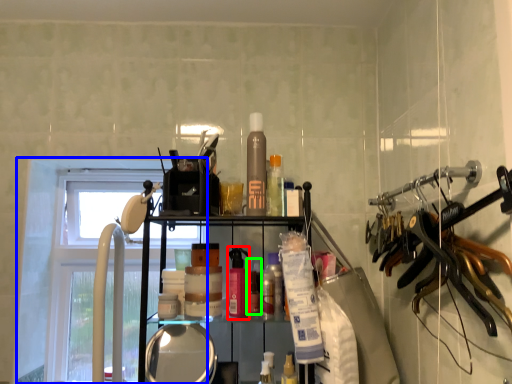
Question: Which object is positioned farthest from toiletry (highlighted by a red box)? Select from window (highlighted by a blue box) and toiletry (highlighted by a green box).

Choices:
 (A) window
 (B) toiletry

Answer: (A)